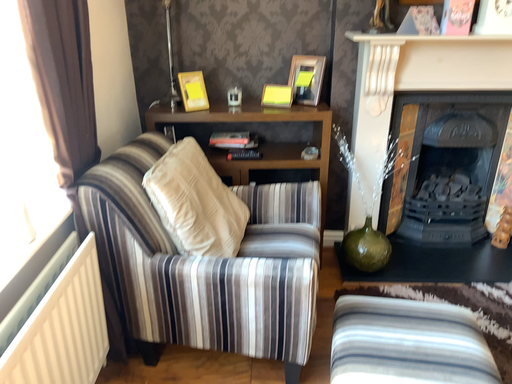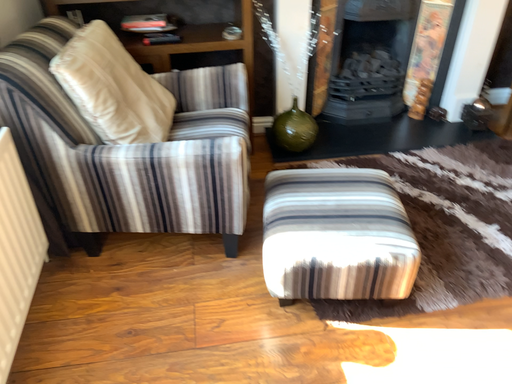
Question: Which way did the camera rotate in the video?

Choices:
 (A) rotated left
 (B) rotated right

Answer: (B)